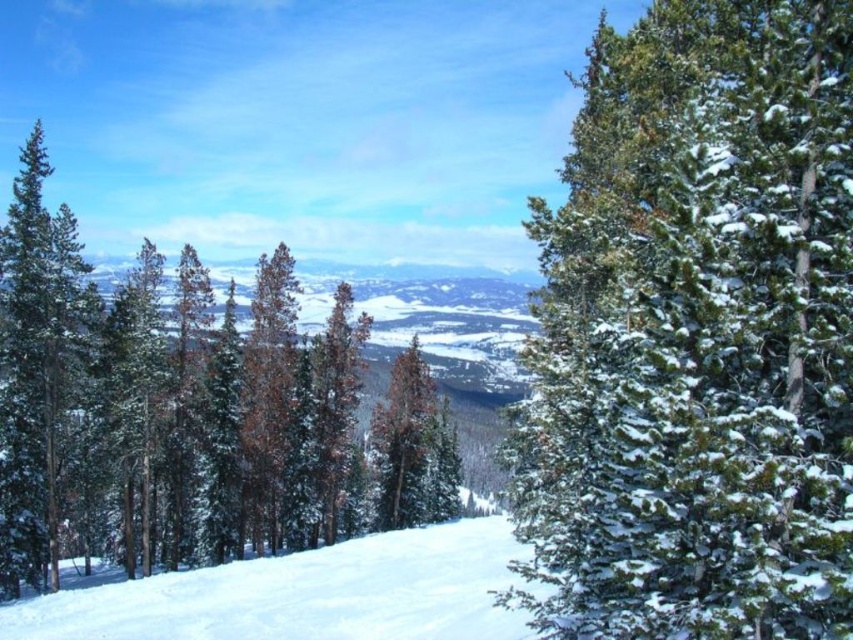
Question: Considering the real-world distances, which object is farthest from the green matte evergreen tree at center?

Choices:
 (A) green textured pine tree at center
 (B) white snow at center
 (C) green matte evergreen tree at left

Answer: (A)

Question: Is white snow at center closer to camera compared to green matte evergreen tree at left?

Choices:
 (A) no
 (B) yes

Answer: (B)

Question: Does green matte evergreen tree at center lie in front of green matte evergreen tree at left?

Choices:
 (A) no
 (B) yes

Answer: (B)

Question: Can you confirm if green matte evergreen tree at center is positioned below green matte evergreen tree at left?

Choices:
 (A) yes
 (B) no

Answer: (A)

Question: Which point is closer to the camera?

Choices:
 (A) white snow at center
 (B) green matte evergreen tree at center

Answer: (A)

Question: Which point is farther to the camera?

Choices:
 (A) [51, 236]
 (B) [805, 452]

Answer: (A)